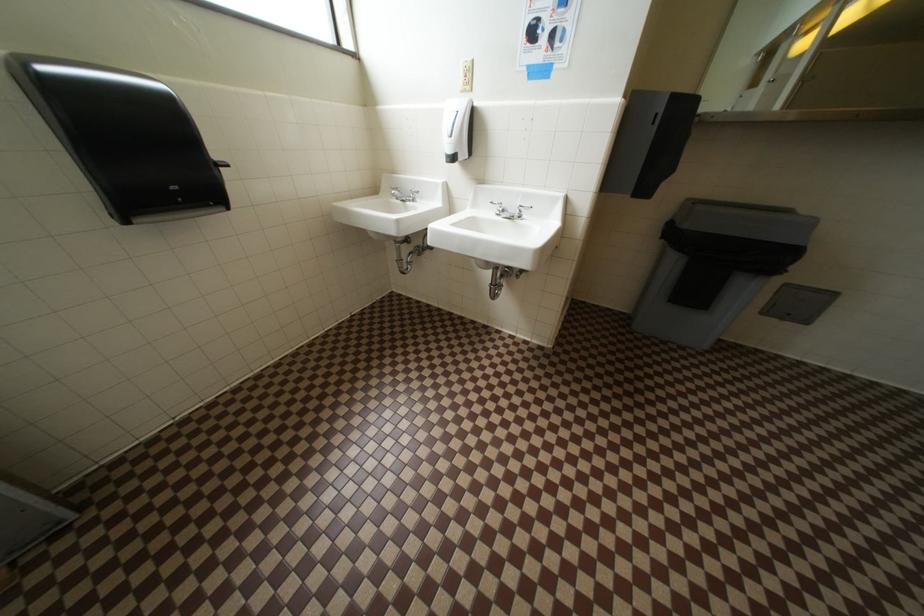
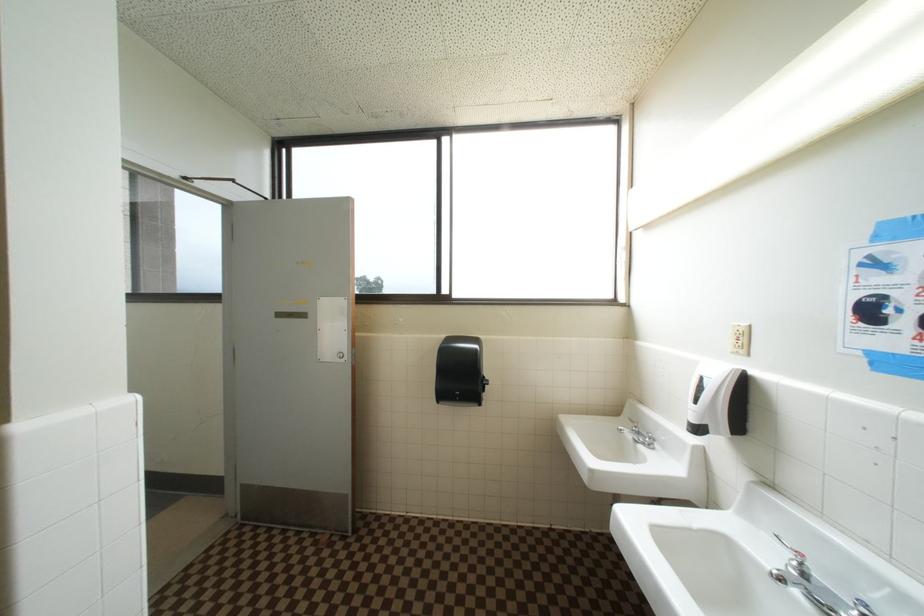
Question: Based on the continuous images, in which direction is the camera rotating? Reply with the corresponding letter.

Choices:
 (A) Left
 (B) Right
 (C) Up
 (D) Down

Answer: (A)